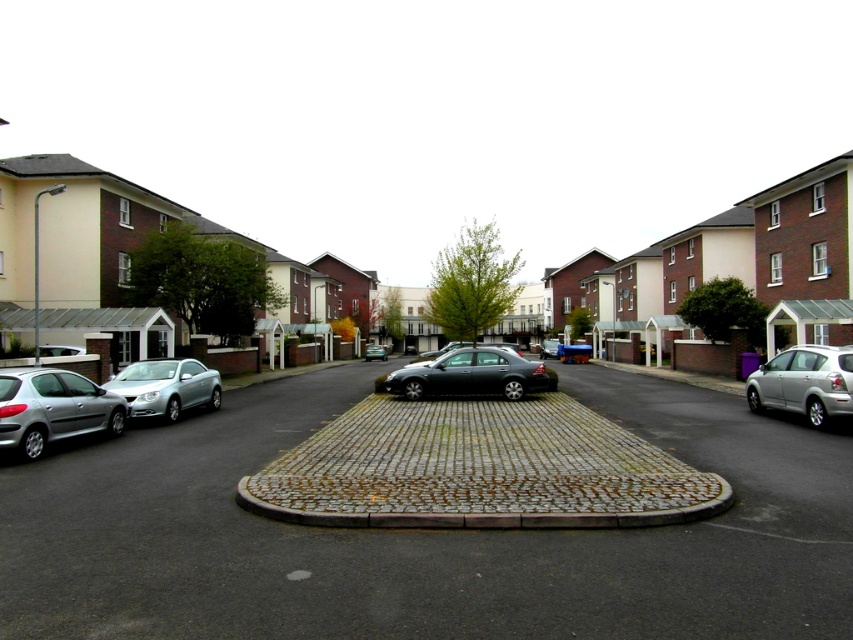
You are a delivery driver who needs to park your truck, which is 5 meters long, in this residential area. The parking spots are between the silver metallic hatchback at left and the shiny black sedan at center. Can your truck fit in the available space between them?

The silver metallic hatchback at left is smaller than the shiny black sedan at center, but the exact distance between them isn

You are standing at point (15,397) and want to reach the roundabout in the center. The roundabout has a radius of 5 meters. Can you safely walk to the roundabout without entering the road?

The distance between you and the roundabout is 10.61 meters, which is greater than the roundabout radius of 5 meters. Therefore, you need to walk towards the roundabout until you are within its 5 meter radius to safely reach it without entering the road.